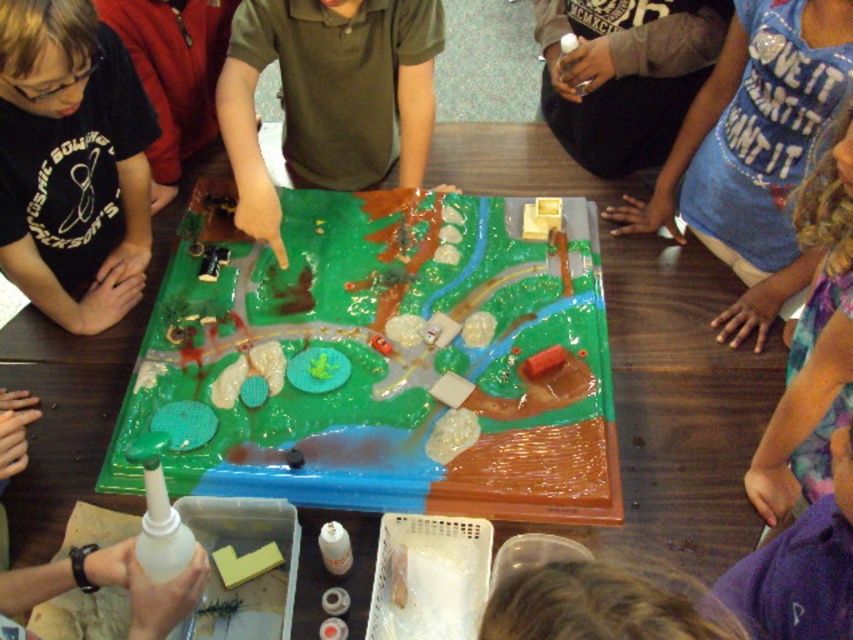
You are a teacher observing the children around the table. You need to pass a note to the child in the black matte shirt at upper left from the green matte board game at center. Can you hand it directly without moving the game or the shirt?

The distance between the green matte board game at center and the black matte shirt at upper left is 15.98 inches, so yes, you can hand the note directly without moving either object since the distance is manageable.